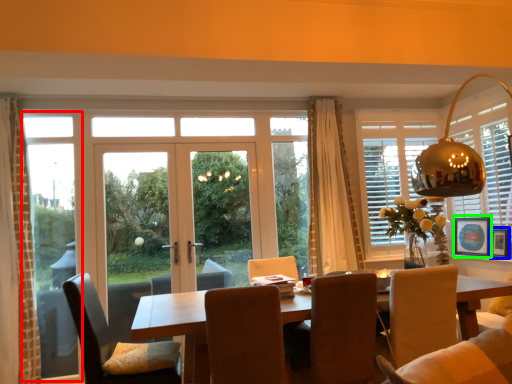
Question: Estimate the real-world distances between objects in this image. Which object is farther from window frame (highlighted by a red box), picture frame (highlighted by a blue box) or picture frame (highlighted by a green box)?

Choices:
 (A) picture frame
 (B) picture frame

Answer: (A)